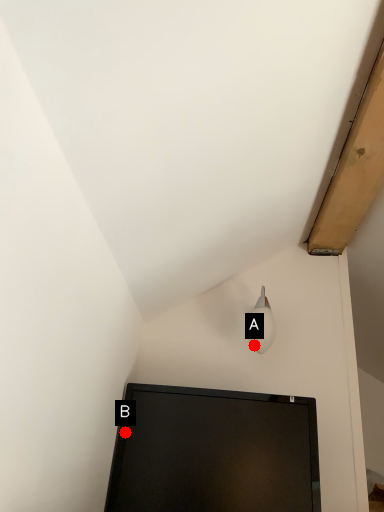
Question: Two points are circled on the image, labeled by A and B beside each circle. Which of the following is the farthest from the observer?

Choices:
 (A) A is further
 (B) B is further

Answer: (A)